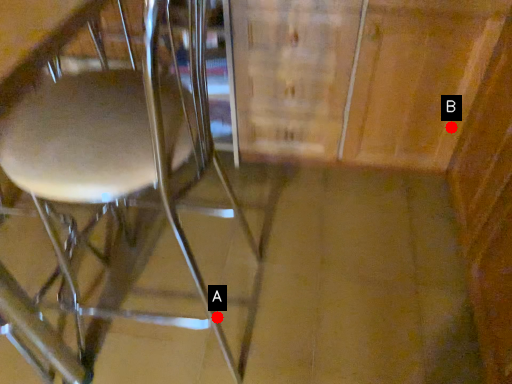
Question: Two points are circled on the image, labeled by A and B beside each circle. Which point appears farthest from the camera in this image?

Choices:
 (A) A is further
 (B) B is further

Answer: (B)